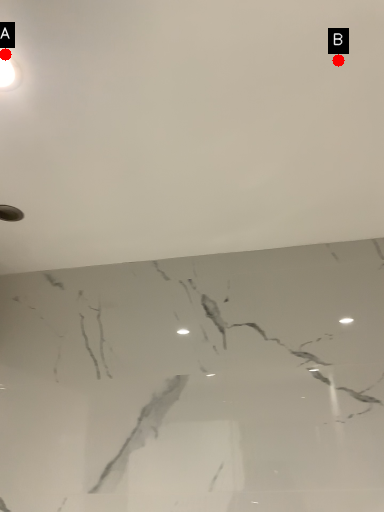
Question: Two points are circled on the image, labeled by A and B beside each circle. Which of the following is the closest to the observer?

Choices:
 (A) A is closer
 (B) B is closer

Answer: (A)